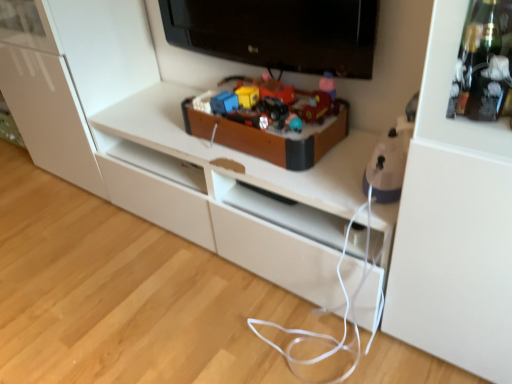
What do you see at coordinates (274, 121) in the screenshot? I see `wooden toy box at center, the 1th toy positioned from the left` at bounding box center [274, 121].

You are a GUI agent. You are given a task and a screenshot of the screen. Output one action in this format:
    pyautogui.click(x=<x>, y=<y>)
    Task: Click on the black glossy television at upper center
    This screenshot has width=512, height=384.
    Given the screenshot: What is the action you would take?
    pyautogui.click(x=278, y=33)

Is purple plastic iron at right, which is the 2th toy in back-to-front order, surrounding black glossy television at upper center?

Actually, black glossy television at upper center is outside purple plastic iron at right, which is the 2th toy in back-to-front order.

From a real-world perspective, between purple plastic iron at right, which is the first toy from right to left, and black glossy television at upper center, who is vertically lower?

purple plastic iron at right, which is the first toy from right to left, from a real-world perspective.

Locate an element on the screen. This screenshot has width=512, height=384. television above the purple plastic iron at right, which is the 2th toy in back-to-front order (from the image's perspective) is located at coordinates (278, 33).

Considering the sizes of purple plastic iron at right, placed as the 2th toy when sorted from left to right, and black glossy television at upper center in the image, is purple plastic iron at right, placed as the 2th toy when sorted from left to right, wider or thinner than black glossy television at upper center?

Considering their sizes, purple plastic iron at right, placed as the 2th toy when sorted from left to right, looks broader than black glossy television at upper center.

Is black glossy television at upper center turned away from purple plastic iron at right, positioned as the 1th toy in front-to-back order?

No, black glossy television at upper center is not facing the opposite direction of purple plastic iron at right, positioned as the 1th toy in front-to-back order.

Measure the distance from black glossy television at upper center to purple plastic iron at right, placed as the 2th toy when sorted from left to right.

They are 20.42 inches apart.

Can you confirm if black glossy television at upper center is taller than purple plastic iron at right, which is the 2th toy in back-to-front order?

Indeed, black glossy television at upper center has a greater height compared to purple plastic iron at right, which is the 2th toy in back-to-front order.

Is black glossy television at upper center bigger or smaller than purple plastic iron at right, placed as the 2th toy when sorted from left to right?

Considering their sizes, black glossy television at upper center takes up more space than purple plastic iron at right, placed as the 2th toy when sorted from left to right.

Is wooden toy box at center, which is the second toy in front-to-back order, inside black glossy television at upper center?

No, wooden toy box at center, which is the second toy in front-to-back order, is not surrounded by black glossy television at upper center.

Is black glossy television at upper center thinner than wooden toy box at center, the 1th toy positioned from the left?

Correct, the width of black glossy television at upper center is less than that of wooden toy box at center, the 1th toy positioned from the left.

How many degrees apart are the facing directions of black glossy television at upper center and wooden toy box at center, which is the second toy in front-to-back order?

90.9 degrees separate the facing orientations of black glossy television at upper center and wooden toy box at center, which is the second toy in front-to-back order.

Considering the relative sizes of black glossy television at upper center and wooden toy box at center, positioned as the 1th toy in back-to-front order, in the image provided, is black glossy television at upper center bigger than wooden toy box at center, positioned as the 1th toy in back-to-front order,?

Yes.

How far apart are purple plastic iron at right, positioned as the 1th toy in front-to-back order, and wooden toy box at center, the 1th toy positioned from the left?

A distance of 12.84 inches exists between purple plastic iron at right, positioned as the 1th toy in front-to-back order, and wooden toy box at center, the 1th toy positioned from the left.

Looking at this image, between purple plastic iron at right, positioned as the 1th toy in front-to-back order, and wooden toy box at center, which appears as the 2th toy when viewed from the right, which one has less height?

With less height is wooden toy box at center, which appears as the 2th toy when viewed from the right.

Is purple plastic iron at right, positioned as the 1th toy in front-to-back order, situated inside wooden toy box at center, positioned as the 1th toy in back-to-front order, or outside?

purple plastic iron at right, positioned as the 1th toy in front-to-back order, is spatially situated outside wooden toy box at center, positioned as the 1th toy in back-to-front order.

Consider the image. Is wooden toy box at center, which is the second toy in front-to-back order, wider or thinner than purple plastic iron at right, which is the 2th toy in back-to-front order?

Considering their sizes, wooden toy box at center, which is the second toy in front-to-back order, looks broader than purple plastic iron at right, which is the 2th toy in back-to-front order.

Is purple plastic iron at right, which is the first toy from right to left, completely or partially inside wooden toy box at center, positioned as the 1th toy in back-to-front order?

No, purple plastic iron at right, which is the first toy from right to left, is not inside wooden toy box at center, positioned as the 1th toy in back-to-front order.

Which of these two, wooden toy box at center, which is the second toy in front-to-back order, or purple plastic iron at right, positioned as the 1th toy in front-to-back order, is bigger?

With larger size is wooden toy box at center, which is the second toy in front-to-back order.

Does wooden toy box at center, positioned as the 1th toy in back-to-front order, turn towards purple plastic iron at right, which is the first toy from right to left?

No, wooden toy box at center, positioned as the 1th toy in back-to-front order, is not oriented towards purple plastic iron at right, which is the first toy from right to left.

From a real-world perspective, does wooden toy box at center, positioned as the 1th toy in back-to-front order, sit lower than black glossy television at upper center?

Yes, from a real-world perspective, wooden toy box at center, positioned as the 1th toy in back-to-front order, is below black glossy television at upper center.

What's the angular difference between wooden toy box at center, the 1th toy positioned from the left, and black glossy television at upper center's facing directions?

The facing directions of wooden toy box at center, the 1th toy positioned from the left, and black glossy television at upper center are 90.9 degrees apart.

Is wooden toy box at center, positioned as the 1th toy in back-to-front order, further to camera compared to black glossy television at upper center?

Yes, it is behind black glossy television at upper center.

Does wooden toy box at center, which is the second toy in front-to-back order, have a smaller size compared to black glossy television at upper center?

Yes, wooden toy box at center, which is the second toy in front-to-back order, is smaller than black glossy television at upper center.

In order to click on television above the purple plastic iron at right, placed as the 2th toy when sorted from left to right (from a real-world perspective) in this screenshot , I will do `click(278, 33)`.

Where is `the 1st toy below the black glossy television at upper center (from a real-world perspective)`? The image size is (512, 384). the 1st toy below the black glossy television at upper center (from a real-world perspective) is located at coordinates (389, 163).

Looking at this image, looking at the image, which one is located further to black glossy television at upper center, wooden toy box at center, which appears as the 2th toy when viewed from the right, or purple plastic iron at right, positioned as the 1th toy in front-to-back order?

purple plastic iron at right, positioned as the 1th toy in front-to-back order, is positioned further to the anchor black glossy television at upper center.

Looking at this image, which object lies further to the anchor point purple plastic iron at right, which is the 2th toy in back-to-front order, black glossy television at upper center or wooden toy box at center, the 1th toy positioned from the left?

black glossy television at upper center.

Considering their positions, is purple plastic iron at right, placed as the 2th toy when sorted from left to right, positioned closer to black glossy television at upper center than wooden toy box at center, the 1th toy positioned from the left?

The object closer to black glossy television at upper center is wooden toy box at center, the 1th toy positioned from the left.

In the scene shown: From the image, which object appears to be farther from wooden toy box at center, the 1th toy positioned from the left, purple plastic iron at right, which is the 2th toy in back-to-front order, or black glossy television at upper center?

purple plastic iron at right, which is the 2th toy in back-to-front order.

Estimate the real-world distances between objects in this image. Which object is closer to purple plastic iron at right, which is the 2th toy in back-to-front order, wooden toy box at center, which appears as the 2th toy when viewed from the right, or black glossy television at upper center?

wooden toy box at center, which appears as the 2th toy when viewed from the right, lies closer to purple plastic iron at right, which is the 2th toy in back-to-front order, than the other object.

From the image, which object appears to be nearer to wooden toy box at center, which appears as the 2th toy when viewed from the right, black glossy television at upper center or purple plastic iron at right, positioned as the 1th toy in front-to-back order?

Among the two, black glossy television at upper center is located nearer to wooden toy box at center, which appears as the 2th toy when viewed from the right.

Locate an element on the screen. toy between black glossy television at upper center and purple plastic iron at right, placed as the 2th toy when sorted from left to right, from top to bottom is located at coordinates (274, 121).